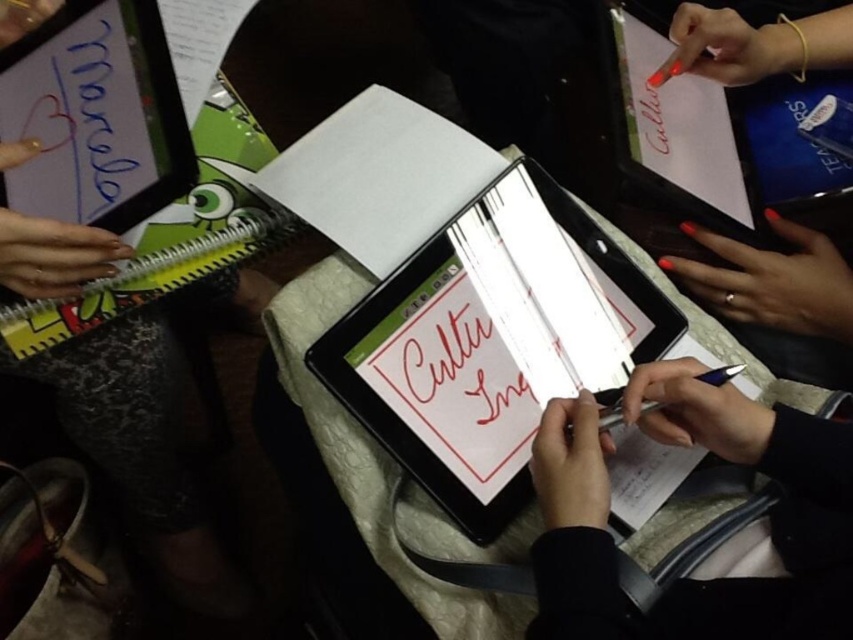
Who is more forward, (776, 604) or (611, 392)?

Positioned in front is point (776, 604).

Who is shorter, smooth black tablet at center or metallic silver pen at center?

metallic silver pen at center is shorter.

Between point (611, 600) and point (602, 404), which one is positioned behind?

Point (602, 404)

Locate an element on the screen. The width and height of the screenshot is (853, 640). smooth black tablet at center is located at coordinates (691, 579).

Is matte black tablet at left wider than metallic silver pen at center?

Yes, matte black tablet at left is wider than metallic silver pen at center.

Can you confirm if matte black tablet at left is positioned to the right of metallic silver pen at center?

No, matte black tablet at left is not to the right of metallic silver pen at center.

At what (x,y) coordinates should I click in order to perform the action: click on matte black tablet at left. Please return your answer as a coordinate pair (x, y). The image size is (853, 640). Looking at the image, I should click on (142, 451).

Where is `matte black tablet at left`? The height and width of the screenshot is (640, 853). matte black tablet at left is located at coordinates (142, 451).

Between point (390, 355) and point (715, 422), which one is positioned behind?

The point (390, 355) is more distant.

Who is taller, white paper at center or smooth black tablet at center?

smooth black tablet at center is taller.

Between point (543, 285) and point (711, 604), which one is positioned in front?

Point (711, 604) is in front.

The width and height of the screenshot is (853, 640). I want to click on white paper at center, so click(x=490, y=342).